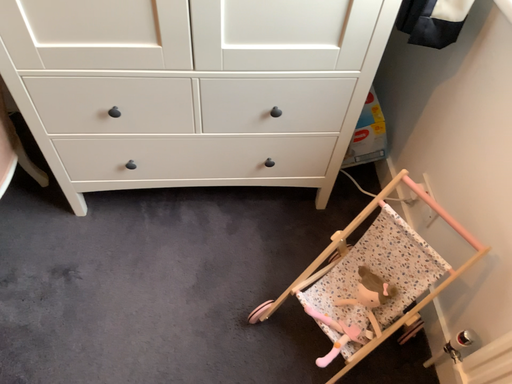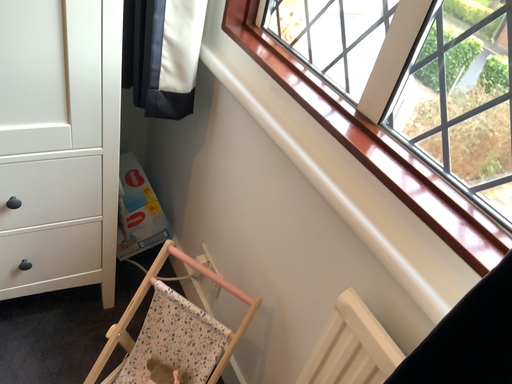
Question: How did the camera likely rotate when shooting the video?

Choices:
 (A) rotated right
 (B) rotated left

Answer: (A)